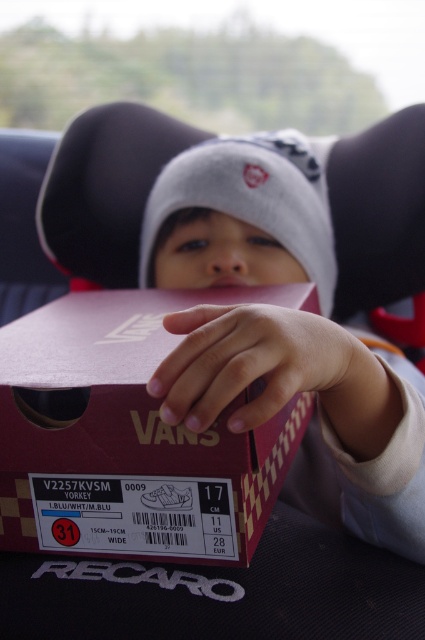
You are a photographer setting up a shoot. You have a matte gray beanie at center and a matte red shoebox at center in front of you. You need to decide which object to place closer to the camera to ensure it appears the same size in the final photo. Which object should you move closer?

The matte gray beanie at center is larger in size than the matte red shoebox at center. To make them appear the same size in the photo, you should move the smaller matte red shoebox at center closer to the camera than the matte gray beanie at center.

You are a delivery person who needs to place a package in the car seat area. The package must be placed between the two points marked as point (319,172) and point (50,529). Based on the scene, where should you position the package?

The package should be placed between the two points, ensuring it is in front of point (319,172) and behind point (50,529) since point (319,172) is behind point (50,529).

You are a photographer taking a picture of the matte gray beanie at center and the matte red shoebox at center. Which object should you focus on first if you want to capture both in the same frame without moving the camera?

The matte red shoebox at center should be focused on first because the matte gray beanie at center is to the right of it, so adjusting focus from the shoebox to the beanie would ensure both are in frame.